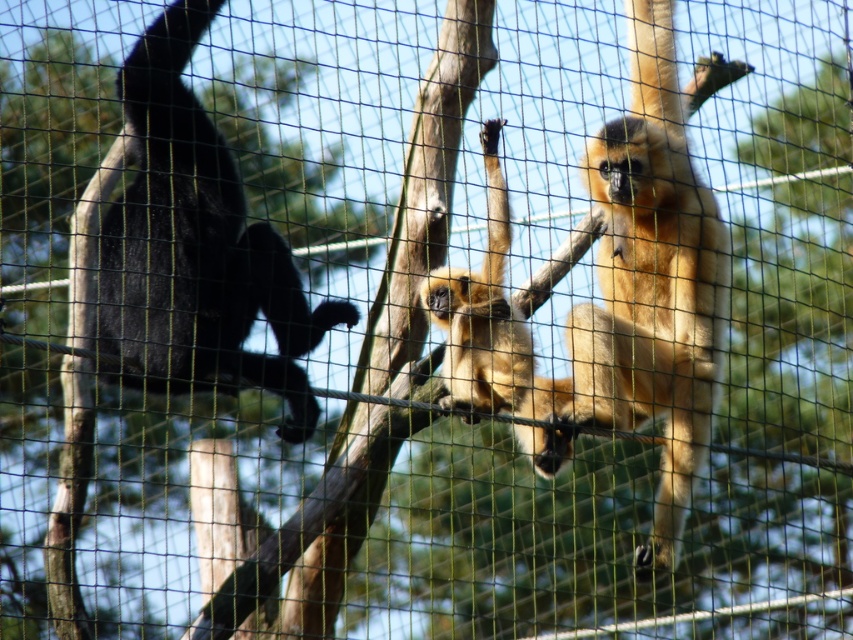
You are observing two golden fur monkeys in the zoo enclosure. The golden fur monkey at right and the golden fur monkey at center are both climbing on wooden branches. From your perspective, which monkey is positioned higher?

The golden fur monkey at right is positioned higher than the golden fur monkey at center because it is above the other.

You are a zookeeper observing the gibbons in their enclosure. You notice the golden fur monkey at right and the shiny black monkey at left. Based on their positions, which monkey is closer to the ground?

The golden fur monkey at right is closer to the ground because it is positioned below the shiny black monkey at left.